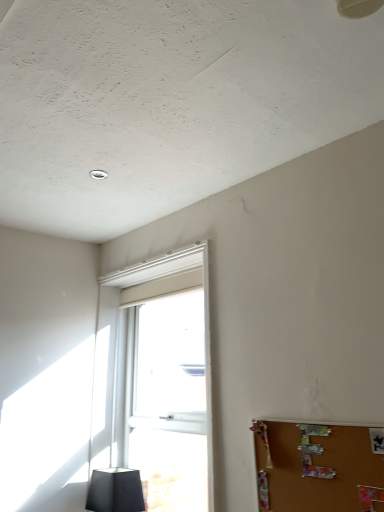
Question: From the image's perspective, is brown corkboard at lower right below white plastic window at center?

Choices:
 (A) yes
 (B) no

Answer: (B)

Question: Does brown corkboard at lower right contain white plastic window at center?

Choices:
 (A) no
 (B) yes

Answer: (A)

Question: Is brown corkboard at lower right taller than white plastic window at center?

Choices:
 (A) no
 (B) yes

Answer: (A)

Question: Is brown corkboard at lower right thinner than white plastic window at center?

Choices:
 (A) no
 (B) yes

Answer: (B)

Question: Does brown corkboard at lower right appear on the right side of white plastic window at center?

Choices:
 (A) no
 (B) yes

Answer: (B)

Question: Is matte black lampshade at lower left spatially inside brown corkboard at lower right, or outside of it?

Choices:
 (A) outside
 (B) inside

Answer: (A)

Question: Is point (119, 481) positioned closer to the camera than point (352, 478)?

Choices:
 (A) closer
 (B) farther

Answer: (B)

Question: Is matte black lampshade at lower left in front of or behind brown corkboard at lower right in the image?

Choices:
 (A) behind
 (B) front

Answer: (A)

Question: From a real-world perspective, is matte black lampshade at lower left positioned above or below brown corkboard at lower right?

Choices:
 (A) below
 (B) above

Answer: (A)

Question: Is brown corkboard at lower right spatially inside white plastic window at center, or outside of it?

Choices:
 (A) inside
 (B) outside

Answer: (B)

Question: Considering the positions of brown corkboard at lower right and white plastic window at center in the image, is brown corkboard at lower right bigger or smaller than white plastic window at center?

Choices:
 (A) big
 (B) small

Answer: (B)

Question: Is brown corkboard at lower right taller or shorter than white plastic window at center?

Choices:
 (A) tall
 (B) short

Answer: (B)

Question: Is brown corkboard at lower right to the left or to the right of white plastic window at center in the image?

Choices:
 (A) right
 (B) left

Answer: (A)

Question: Which is correct: brown corkboard at lower right is inside matte black lampshade at lower left, or outside of it?

Choices:
 (A) inside
 (B) outside

Answer: (B)

Question: In terms of width, does brown corkboard at lower right look wider or thinner when compared to matte black lampshade at lower left?

Choices:
 (A) wide
 (B) thin

Answer: (B)